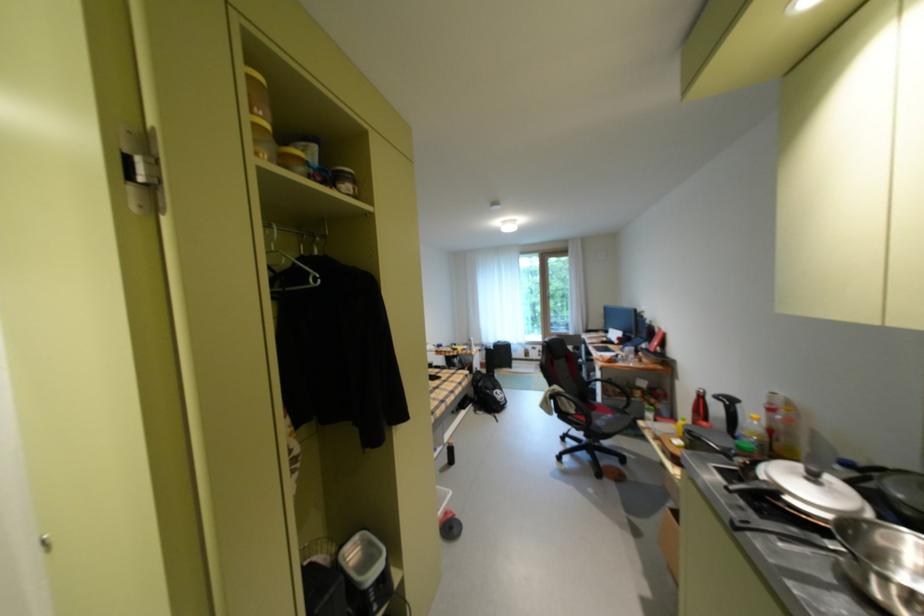
This screenshot has height=616, width=924. In order to click on black chair armrest in this screenshot , I will do `click(564, 400)`.